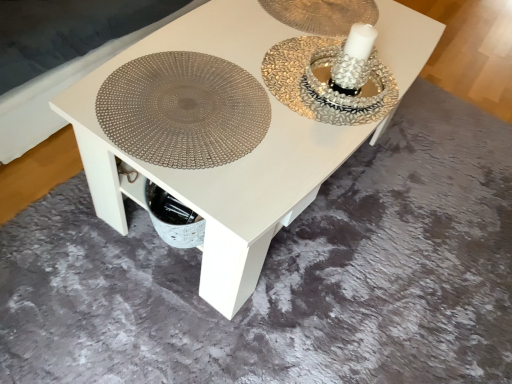
This screenshot has height=384, width=512. Find the location of `free space above white glossy table at center (from a real-world perspective)`. free space above white glossy table at center (from a real-world perspective) is located at coordinates (282, 62).